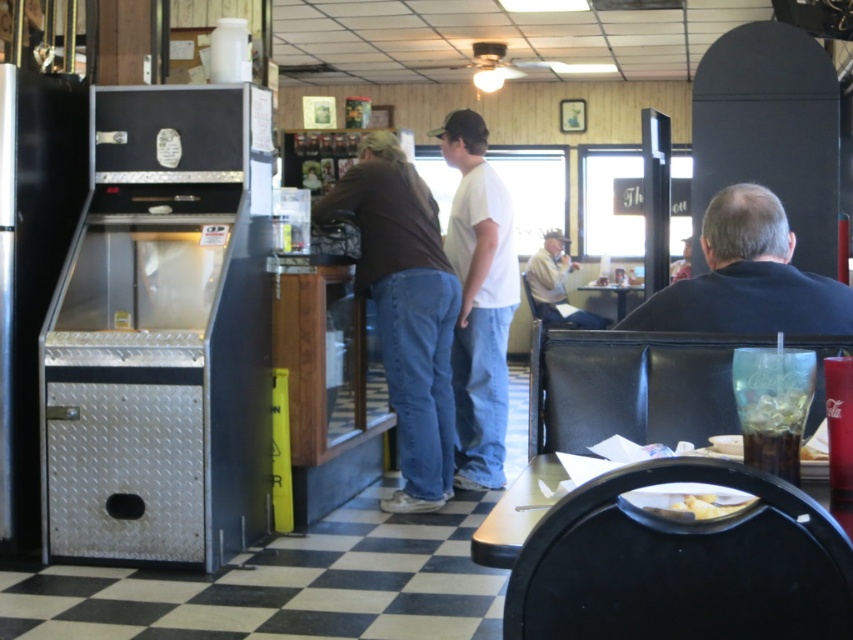
You are a customer at the diner and want to pick up your translucent plastic cup at lower right. However, there is a person in a dark blue shirt at right in the way. Based on their positions, can you easily reach the cup without disturbing them?

The dark blue shirt at right is located above the translucent plastic cup at lower right, meaning the person is standing over the cup. This likely blocks direct access, so you would need to ask them to move or step around them to reach the cup.

You are a customer in the diner and want to order a drink. The bartender is at the counter. Where is the dark blue shirt at right located relative to the point marked at coordinates (747, 276)?

The dark blue shirt at right is located at the point marked at coordinates (747, 276).

You are a customer in the diner and want to grab the translucent plastic cup at lower right without touching the dark blue shirt at right. Is this possible based on their sizes?

The dark blue shirt at right is taller than the translucent plastic cup at lower right, so the shirt might block access to the cup. It might not be possible to grab the cup without moving or avoiding the shirt.